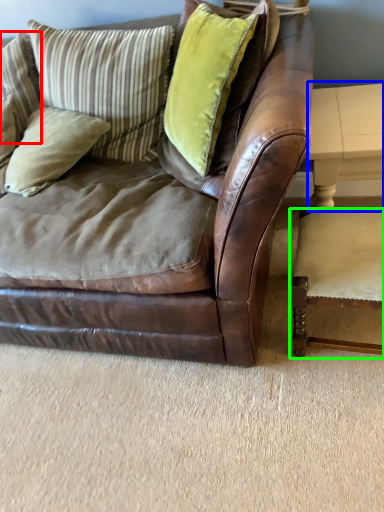
Question: Considering the real-world distances, which object is farthest from pillow (highlighted by a red box)? table (highlighted by a blue box) or chair (highlighted by a green box)?

Choices:
 (A) table
 (B) chair

Answer: (B)